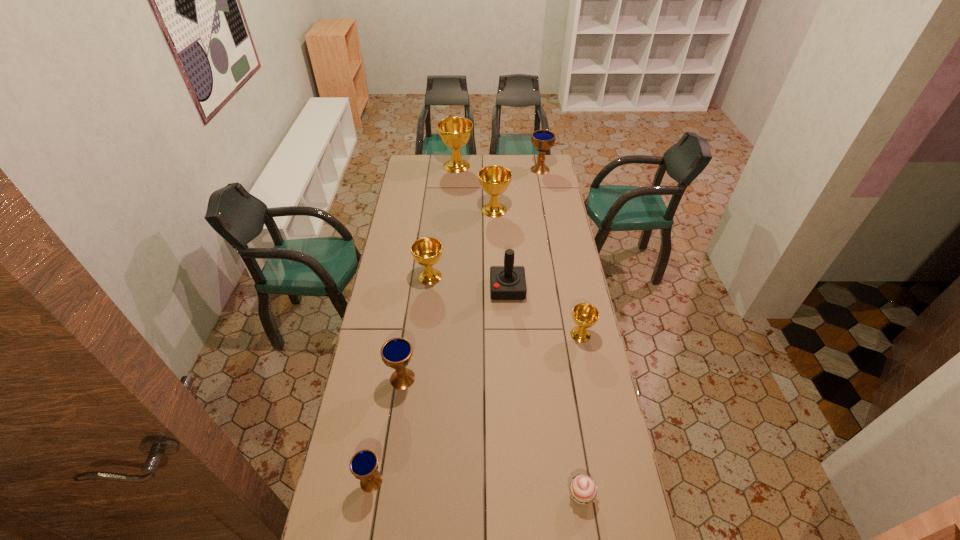
Locate an element on the screen. vacant position in the image that satisfies the following two spatial constraints: 1. on the base of the joystick; 2. on the left side of the shortest object is located at coordinates (520, 495).

Locate an element on the screen. vacant space that satisfies the following two spatial constraints: 1. on the back side of the third biggest gold chalice; 2. on the right side of the second farthest gold chalice is located at coordinates (438, 210).

Where is `free spot that satisfies the following two spatial constraints: 1. on the front side of the farthest blue chalice; 2. on the base of the joystick`? Image resolution: width=960 pixels, height=540 pixels. free spot that satisfies the following two spatial constraints: 1. on the front side of the farthest blue chalice; 2. on the base of the joystick is located at coordinates (562, 289).

The image size is (960, 540). In order to click on free space that satisfies the following two spatial constraints: 1. on the front side of the second gold chalice from right to left; 2. on the left side of the biggest gold chalice in this screenshot , I will do `click(454, 210)`.